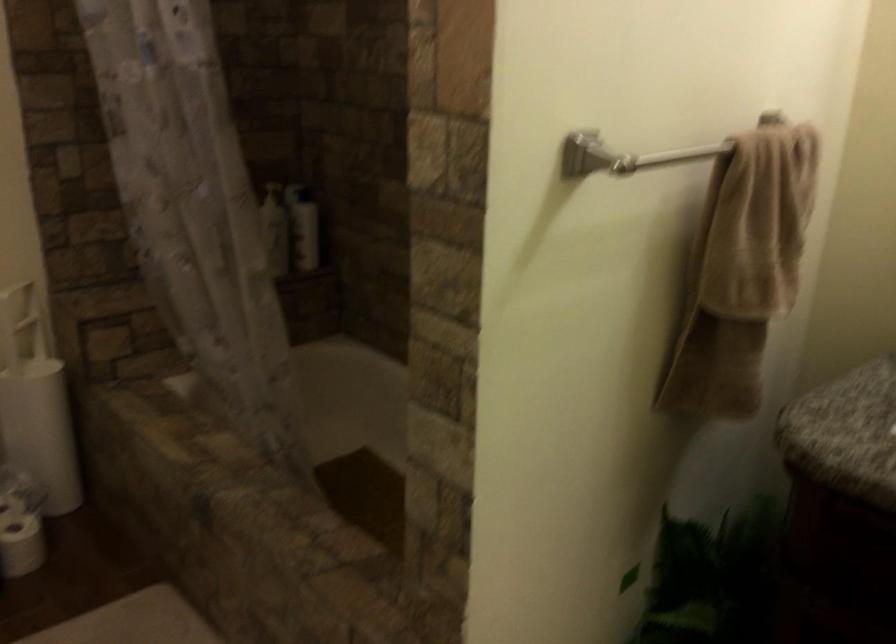
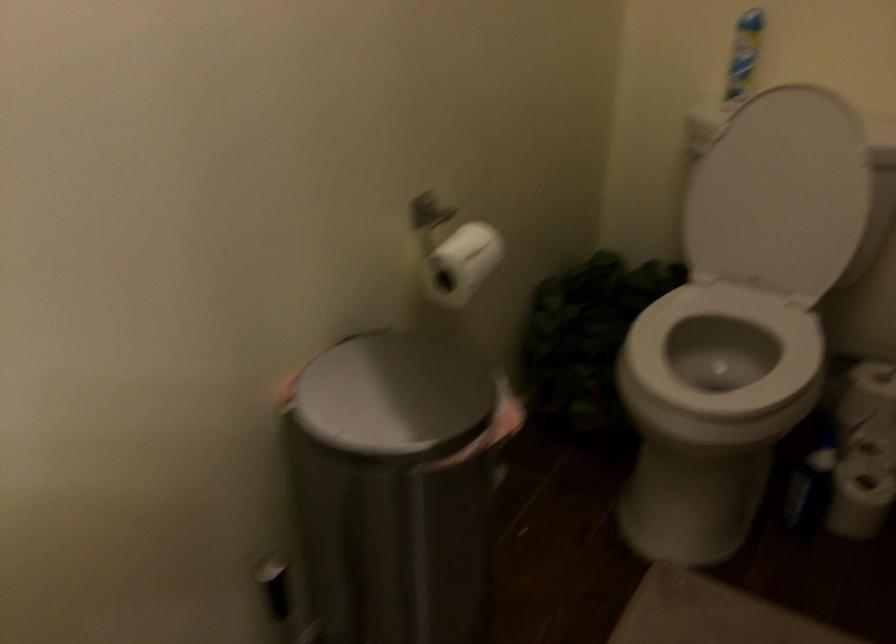
Consider the image. The first image is from the beginning of the video and the second image is from the end. How did the camera likely rotate when shooting the video?

The rotation direction of the camera is left-down.